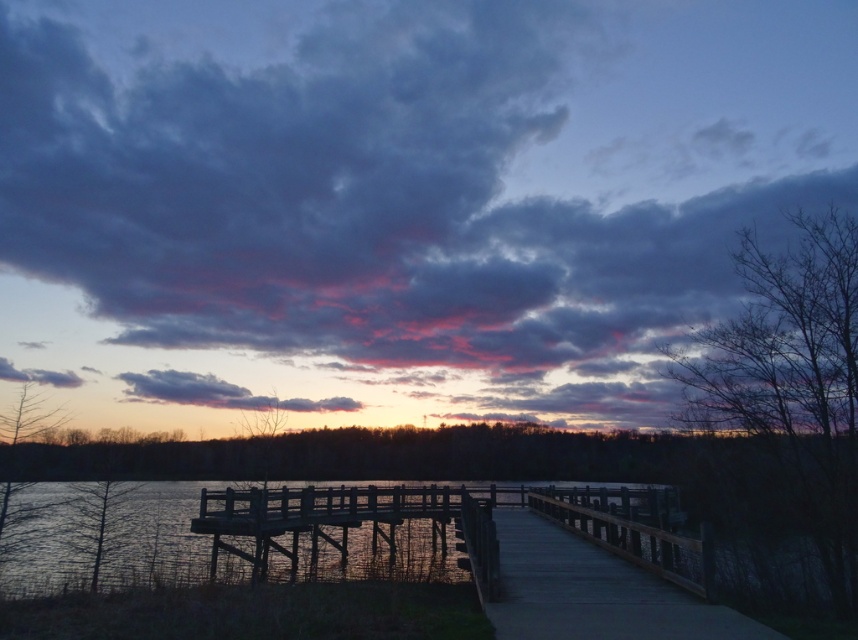
You are standing on the smooth concrete walkway at center and looking up at the purple matte cloud at upper center. Which object is closer to your eyes?

The purple matte cloud at upper center is closer to your eyes because it is positioned in front of the smooth concrete walkway at center.

You are standing at the lakeside and want to take a photo of the purple matte cloud at upper center. If your camera has a maximum focus range of 15 meters, will it be able to capture the cloud in focus?

The purple matte cloud at upper center is 14.89 meters away from camera, so yes, the camera can focus on it since the distance is within the 15 meters range.

You are standing at the point with coordinates (594, 593) in the lakeside scene. What type of surface are you currently standing on?

The point (594, 593) is on smooth concrete walkway at center, so you are standing on a smooth concrete walkway.